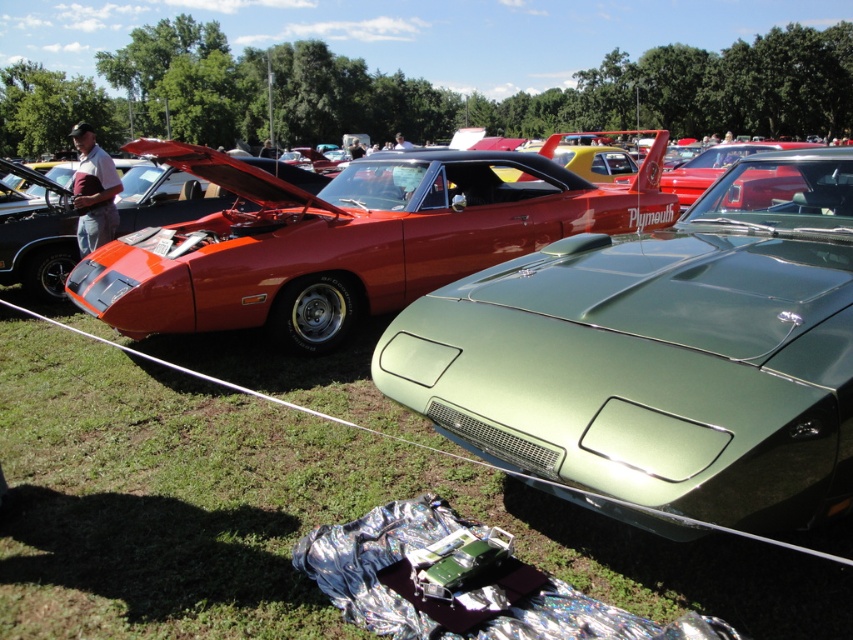
Between satin green car at center and silver reflective foil at lower center, which one is positioned lower?

silver reflective foil at lower center

Which is above, satin green car at center or silver reflective foil at lower center?

satin green car at center is above.

At what (x,y) coordinates should I click in order to perform the action: click on satin green car at center. Please return your answer as a coordinate pair (x, y). The width and height of the screenshot is (853, 640). Looking at the image, I should click on (660, 356).